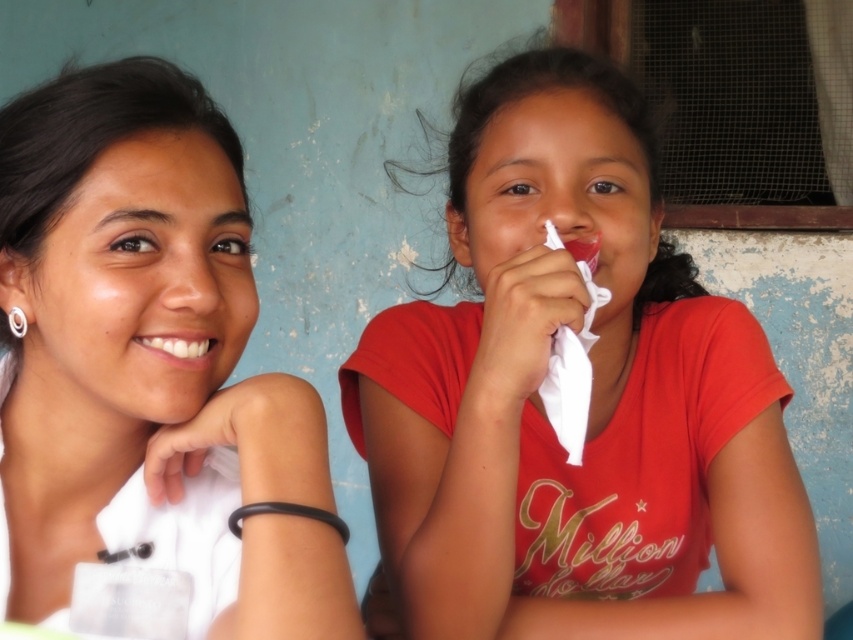
Is point (498, 419) closer to viewer compared to point (143, 477)?

No, it is behind (143, 477).

Consider the image. How far apart are red matte shirt at center and white matte shirt at upper left?

The distance of red matte shirt at center from white matte shirt at upper left is 11.88 inches.

What do you see at coordinates (589, 404) in the screenshot? The height and width of the screenshot is (640, 853). I see `red matte shirt at center` at bounding box center [589, 404].

You are a GUI agent. You are given a task and a screenshot of the screen. Output one action in this format:
    pyautogui.click(x=<x>, y=<y>)
    Task: Click on the red matte shirt at center
    Image resolution: width=853 pixels, height=640 pixels.
    Given the screenshot: What is the action you would take?
    pyautogui.click(x=589, y=404)

Which of these two, red matte shirt at center or white glossy teeth at center, stands taller?

Standing taller between the two is red matte shirt at center.

Is red matte shirt at center shorter than white glossy teeth at center?

Incorrect, red matte shirt at center's height does not fall short of white glossy teeth at center's.

Which is behind, point (457, 132) or point (183, 356)?

Positioned behind is point (457, 132).

Image resolution: width=853 pixels, height=640 pixels. I want to click on red matte shirt at center, so click(x=589, y=404).

This screenshot has width=853, height=640. What do you see at coordinates (148, 369) in the screenshot? I see `white matte shirt at upper left` at bounding box center [148, 369].

Measure the distance between white matte shirt at upper left and camera.

white matte shirt at upper left is 56.61 centimeters away from camera.

What are the coordinates of `white matte shirt at upper left` in the screenshot? It's located at [x=148, y=369].